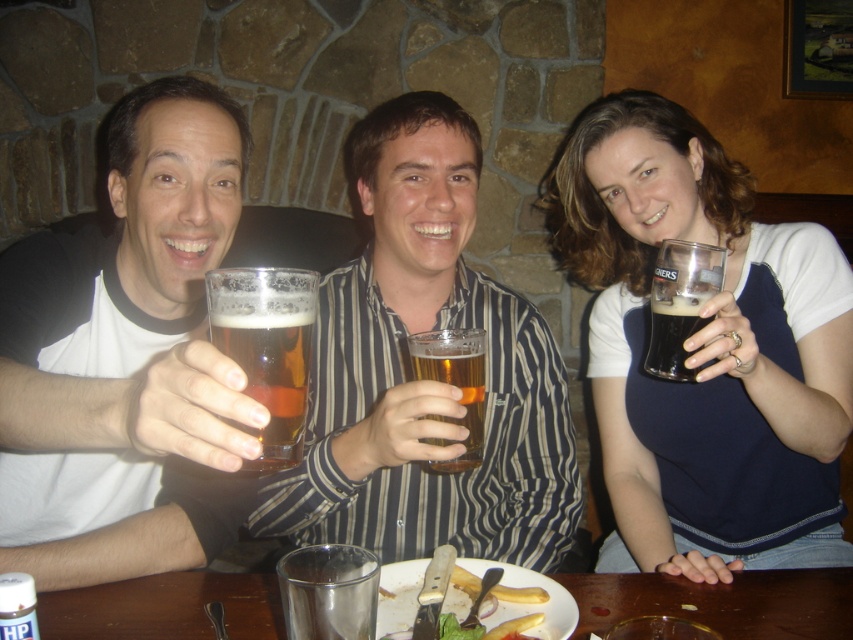
You are a food delivery robot that needs to place a new order of yellowish matte fries at lower center onto the wooden table at center. Considering their heights, will the fries be placed entirely on the table?

The wooden table at center has a lesser height compared to yellowish matte fries at lower center, so the fries might not be placed entirely on the table since the table is shorter than the fries.

You are a photographer standing in front of the wooden table at center. You want to take a closeup shot of the beer glasses on the table. The camera you are using has a minimum focusing distance of 50 centimeters. Will you be able to take the photo without moving closer?

The wooden table at center is 78.83 centimeters from viewer, which is beyond the camera minimum focusing distance of 50 centimeters. Therefore, you can take the closeup shot without moving closer.

You are a photographer setting up for a group photo. You want to ensure the wooden table at center is in focus. If your camera has a depth of field that can sharply capture objects within 30 inches, will the table be in focus?

The wooden table at center is 31.04 inches from the camera, which is slightly beyond the 30 inch depth of field range. Therefore, the table may not be in focus.